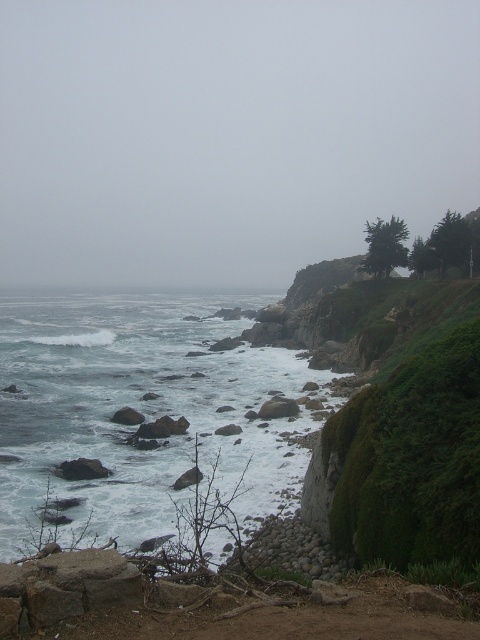
Question: Is the position of foggy sky at upper center more distant than that of white frothy water at lower left?

Choices:
 (A) yes
 (B) no

Answer: (A)

Question: Which of the following is the farthest from the observer?

Choices:
 (A) foggy sky at upper center
 (B) white frothy water at lower left

Answer: (A)

Question: Can you confirm if foggy sky at upper center is thinner than white frothy water at lower left?

Choices:
 (A) no
 (B) yes

Answer: (A)

Question: Considering the relative positions of foggy sky at upper center and white frothy water at lower left in the image provided, where is foggy sky at upper center located with respect to white frothy water at lower left?

Choices:
 (A) left
 (B) right

Answer: (A)

Question: Which object appears farthest from the camera in this image?

Choices:
 (A) white frothy water at lower left
 (B) foggy sky at upper center

Answer: (B)